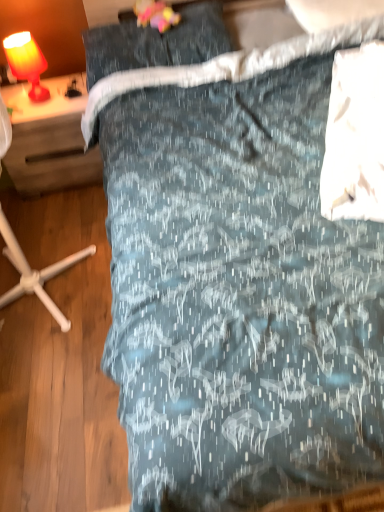
The height and width of the screenshot is (512, 384). I want to click on vacant space in front of matte orange lamp at upper left, so click(41, 115).